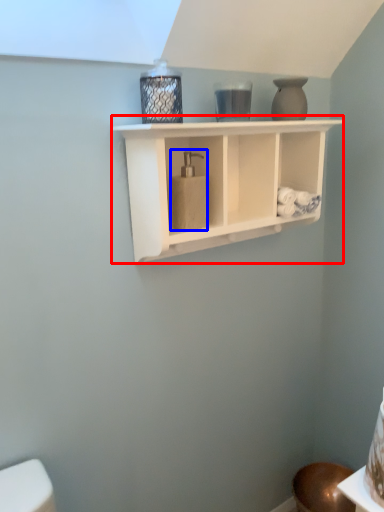
Question: Which point is further to the camera, shelf (highlighted by a red box) or soap dispenser (highlighted by a blue box)?

Choices:
 (A) shelf
 (B) soap dispenser

Answer: (B)